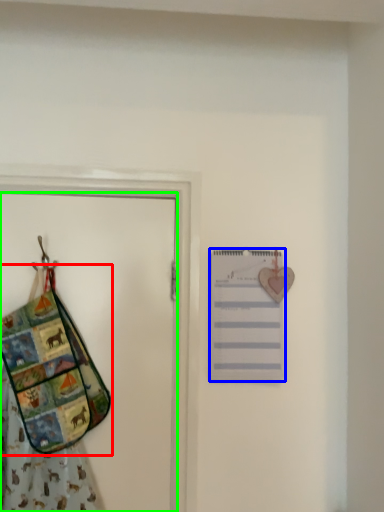
Question: Which is farther away from handbag (highlighted by a red box)? list (highlighted by a blue box) or door (highlighted by a green box)?

Choices:
 (A) list
 (B) door

Answer: (A)